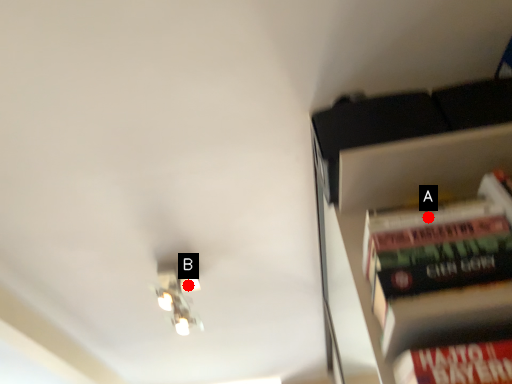
Question: Two points are circled on the image, labeled by A and B beside each circle. Which point is farther to the camera?

Choices:
 (A) A is further
 (B) B is further

Answer: (B)